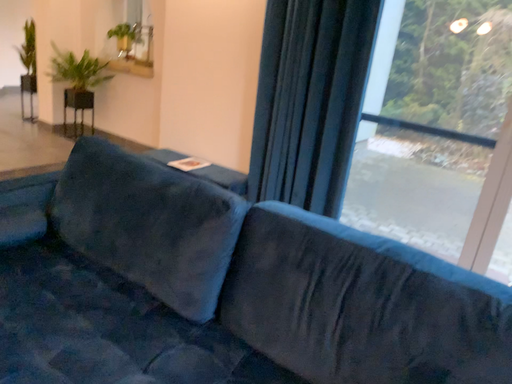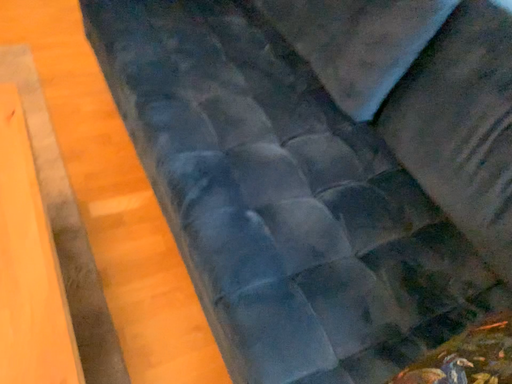
Question: Which way did the camera rotate in the video?

Choices:
 (A) rotated upward
 (B) rotated downward

Answer: (B)